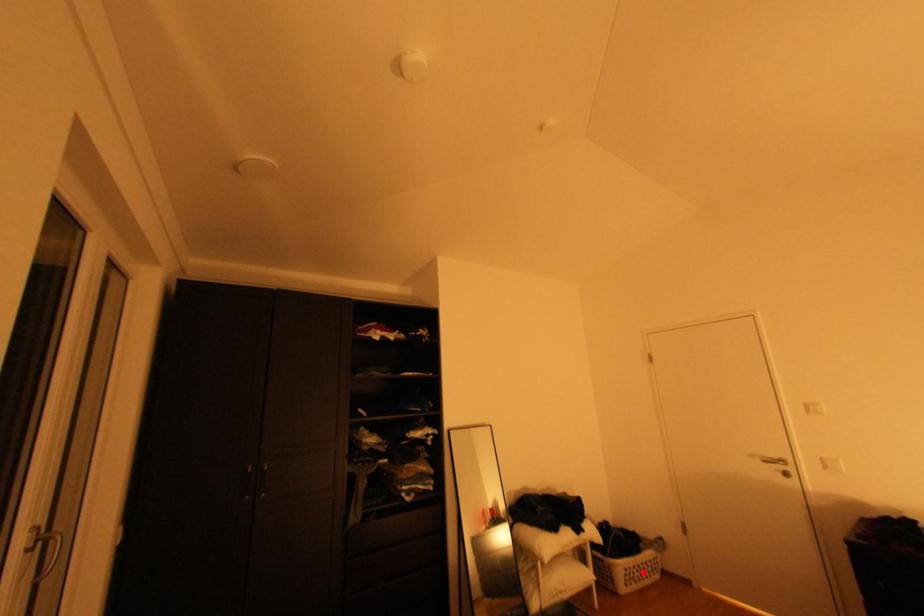
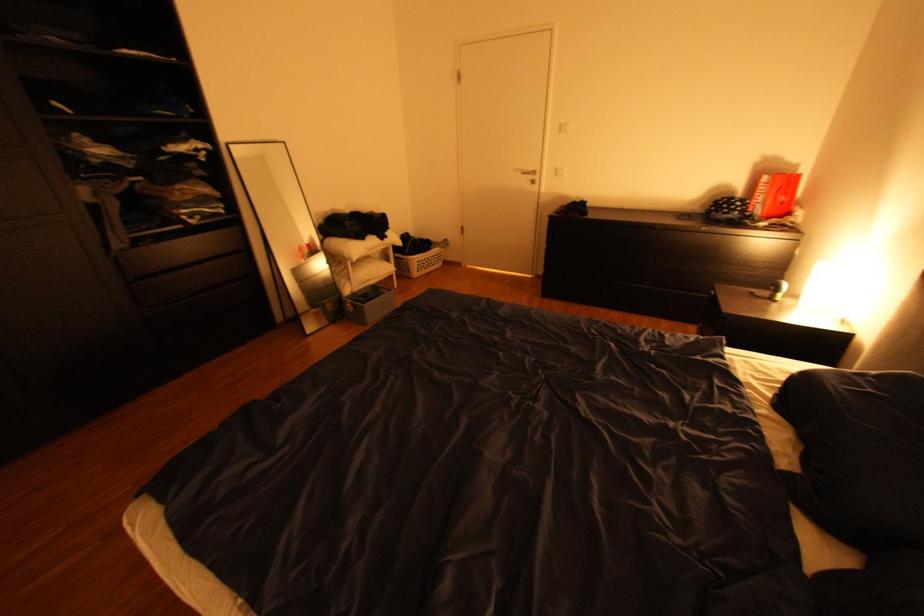
Question: I am providing you with two images of the same scene from different viewpoints. Given a red point in image1, look at the same physical point in image2. Is it:

Choices:
 (A) Closer to the viewpoint
 (B) Farther from the viewpoint

Answer: (A)